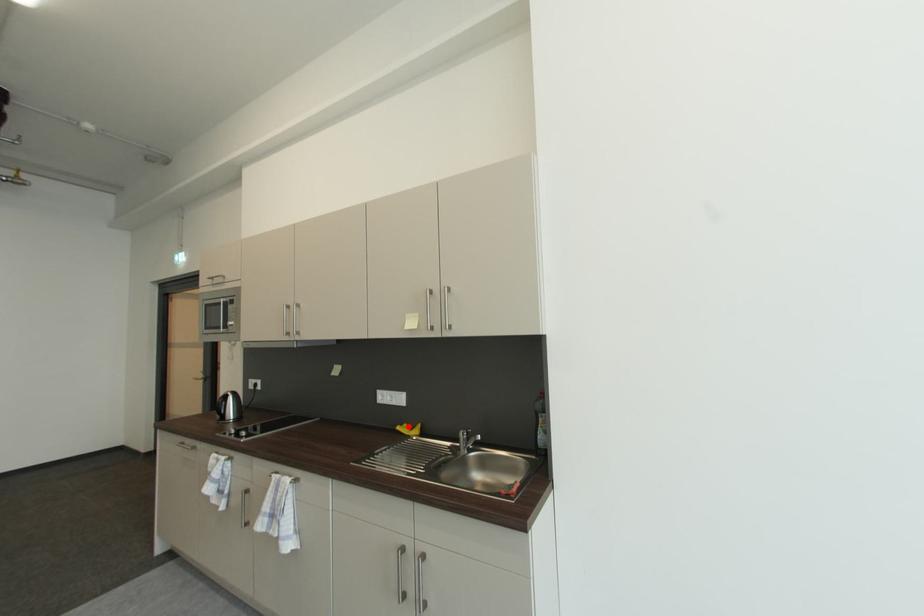
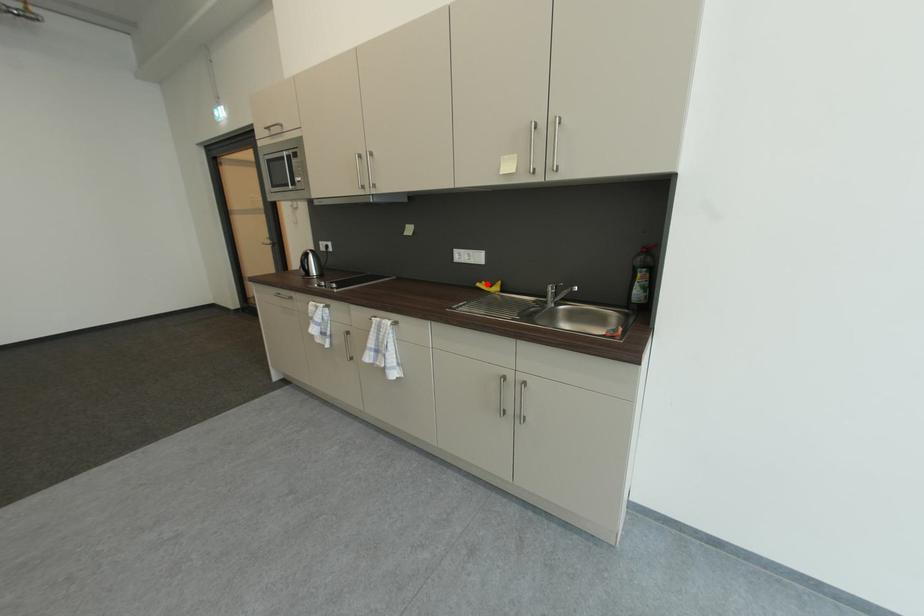
I am providing you with two images of the same scene from different viewpoints. A red point is marked on the first image and another point is marked on the second image. Do the highlighted points in image1 and image2 indicate the same real-world spot?

Yes